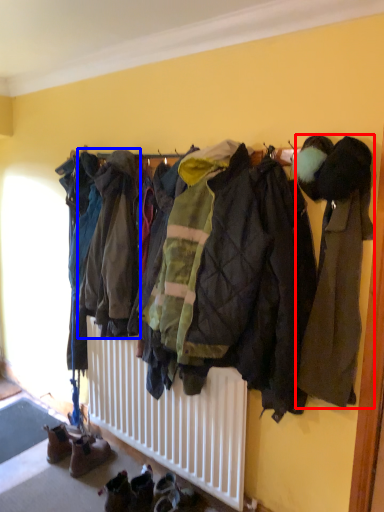
Question: Which object is closer to the camera taking this photo, jacket (highlighted by a red box) or jacket (highlighted by a blue box)?

Choices:
 (A) jacket
 (B) jacket

Answer: (A)